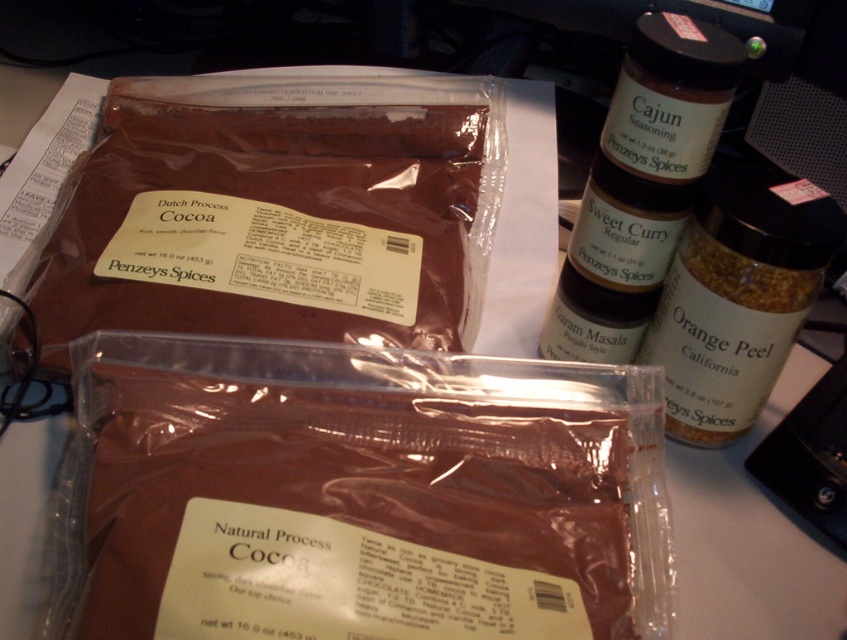
Is brown matte cocoa at upper left behind orange peel spice at upper right?

Yes, brown matte cocoa at upper left is further from the viewer.

Is the position of brown matte cocoa at upper left less distant than that of orange peel spice at upper right?

No, it is not.

Where is `brown matte cocoa at upper left`? Image resolution: width=847 pixels, height=640 pixels. brown matte cocoa at upper left is located at coordinates (275, 212).

Can you confirm if brown glass jar at upper right is positioned below orange peel spice at upper right?

No, brown glass jar at upper right is not below orange peel spice at upper right.

Locate an element on the screen. This screenshot has width=847, height=640. brown glass jar at upper right is located at coordinates (641, 186).

Between brown matte cocoa at upper left and brown glass jar at upper right, which one has more height?

brown glass jar at upper right is taller.

Does brown matte cocoa at upper left appear over brown glass jar at upper right?

Correct, brown matte cocoa at upper left is located above brown glass jar at upper right.

Does point (219, 99) come in front of point (685, 182)?

No.

The height and width of the screenshot is (640, 847). What are the coordinates of `brown matte cocoa at upper left` in the screenshot? It's located at (275, 212).